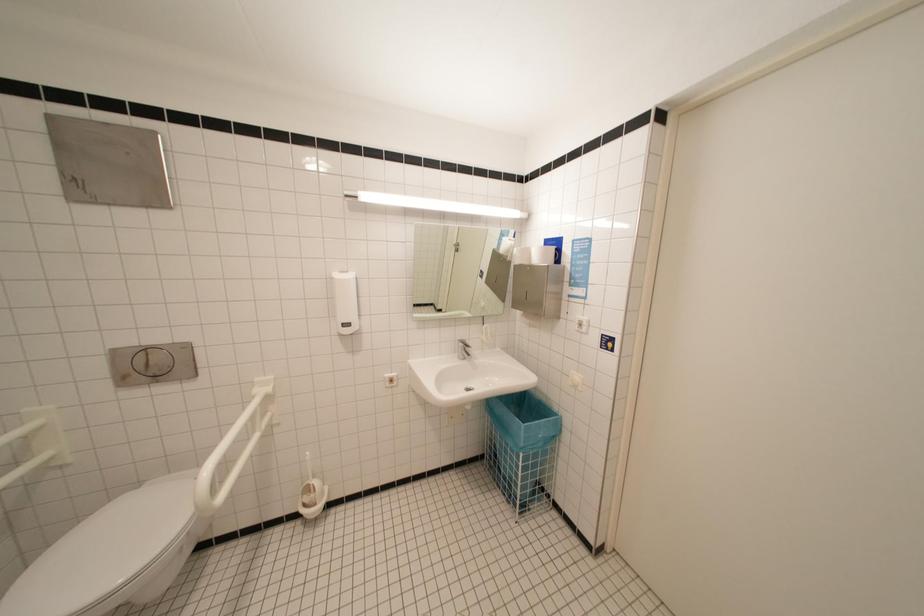
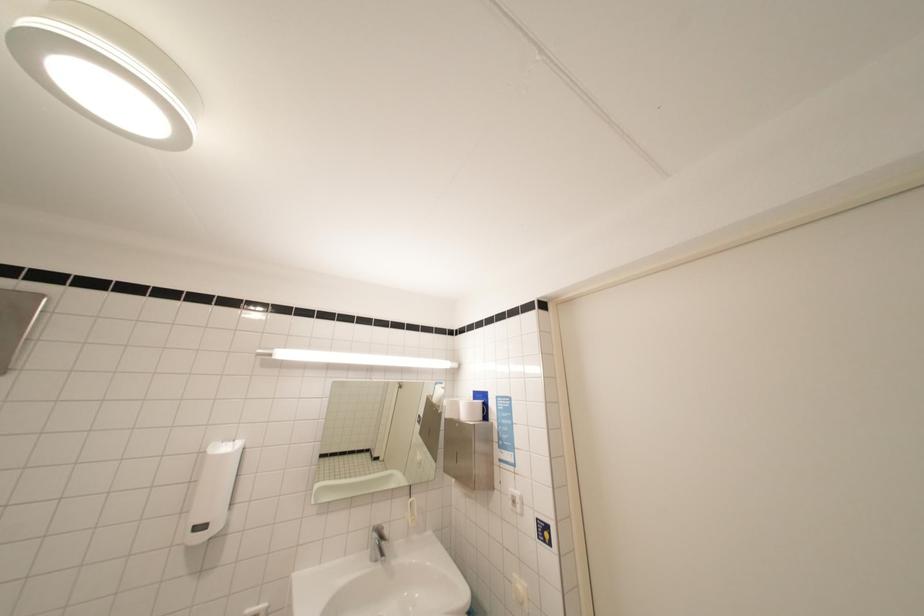
Question: The images are taken continuously from a first-person perspective. In which direction is your viewpoint rotating?

Choices:
 (A) Left
 (B) Right
 (C) Up
 (D) Down

Answer: (C)